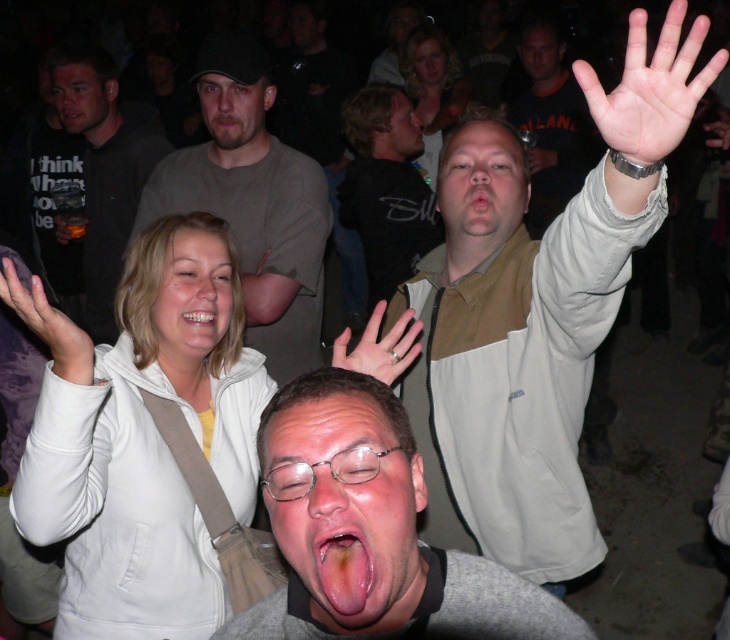
Question: Where is matte black t-shirt at upper left located in relation to dark gray shirt at upper right in the image?

Choices:
 (A) right
 (B) left

Answer: (B)

Question: Does beige fabric jacket at upper right appear on the left side of bearded man at center?

Choices:
 (A) no
 (B) yes

Answer: (A)

Question: Which point is farther to the camera?

Choices:
 (A) pinkish skin hand at center
 (B) light skin hand at upper right

Answer: (A)

Question: Does gray fabric shirt at center have a smaller size compared to matte black t-shirt at upper left?

Choices:
 (A) no
 (B) yes

Answer: (B)

Question: Which of the following is the farthest from the observer?

Choices:
 (A) (534, 67)
 (B) (80, 90)

Answer: (A)

Question: Among these objects, which one is farthest from the camera?

Choices:
 (A) matte black face at upper left
 (B) blonde hair at upper center
 (C) gold ring at center
 (D) matte black t-shirt at upper left

Answer: (B)